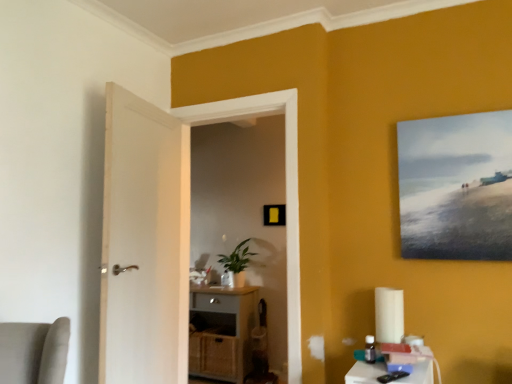
Question: From the image's perspective, does matte gray cabinet at center appear higher than green matte plant at center?

Choices:
 (A) no
 (B) yes

Answer: (A)

Question: Is matte gray cabinet at center aimed at green matte plant at center?

Choices:
 (A) yes
 (B) no

Answer: (B)

Question: Is matte gray cabinet at center located outside green matte plant at center?

Choices:
 (A) yes
 (B) no

Answer: (A)

Question: Can you confirm if matte gray cabinet at center is positioned to the left of green matte plant at center?

Choices:
 (A) yes
 (B) no

Answer: (A)

Question: Can you see matte gray cabinet at center touching green matte plant at center?

Choices:
 (A) yes
 (B) no

Answer: (B)

Question: Visually, is matte black picture frame at center, the 2th picture frame in the right-to-left sequence, positioned to the left or to the right of matte canvas painting at upper right, the second picture frame viewed from the left?

Choices:
 (A) right
 (B) left

Answer: (B)

Question: From the image's perspective, is matte black picture frame at center, which appears as the 1th picture frame when viewed from the left, above or below matte canvas painting at upper right, the second picture frame viewed from the left?

Choices:
 (A) above
 (B) below

Answer: (B)

Question: From a real-world perspective, relative to matte canvas painting at upper right, the first picture frame when ordered from right to left, is matte black picture frame at center, the second picture frame in the front-to-back sequence, vertically above or below?

Choices:
 (A) above
 (B) below

Answer: (B)

Question: Which is correct: matte black picture frame at center, the second picture frame in the front-to-back sequence, is inside matte canvas painting at upper right, the first picture frame when ordered from right to left, or outside of it?

Choices:
 (A) inside
 (B) outside

Answer: (B)

Question: From the image's perspective, is matte white door at center above or below matte canvas painting at upper right, which is the 2th picture frame from back to front?

Choices:
 (A) below
 (B) above

Answer: (A)

Question: Looking at their shapes, would you say matte white door at center is wider or thinner than matte canvas painting at upper right, placed as the 1th picture frame when sorted from front to back?

Choices:
 (A) wide
 (B) thin

Answer: (A)

Question: Is point (294, 379) closer or farther from the camera than point (449, 125)?

Choices:
 (A) farther
 (B) closer

Answer: (A)

Question: Based on their sizes in the image, would you say matte white door at center is bigger or smaller than matte canvas painting at upper right, the second picture frame viewed from the left?

Choices:
 (A) small
 (B) big

Answer: (B)

Question: Considering the positions of point (399, 364) and point (226, 254), is point (399, 364) closer or farther from the camera than point (226, 254)?

Choices:
 (A) farther
 (B) closer

Answer: (B)

Question: Based on their positions, is white plastic table at lower right located to the left or right of green matte plant at center?

Choices:
 (A) right
 (B) left

Answer: (A)